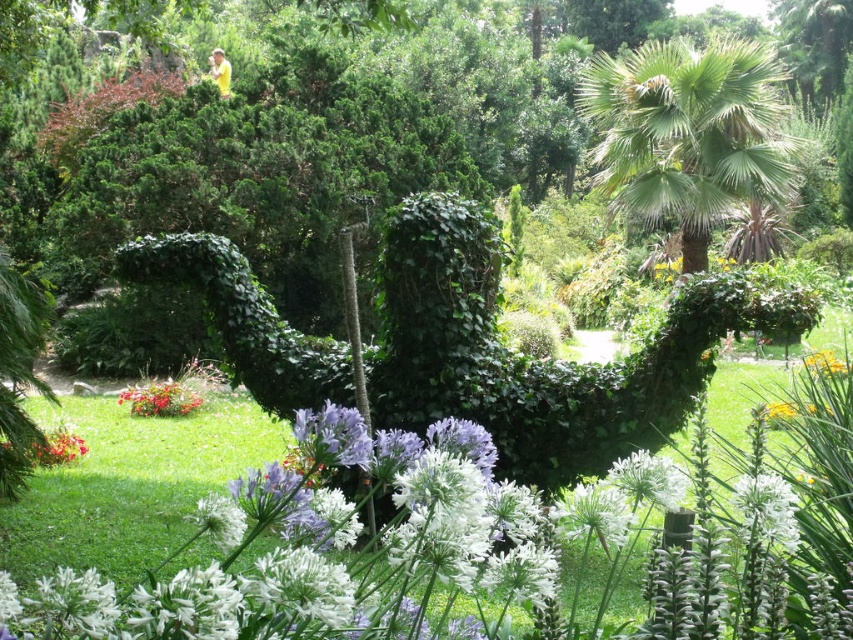
You are a gardener who wants to plant a new flower in the garden. You have two options from the image provided. Which of the two, the green leafy ivy at center or the bright red petals at lower left, would you choose if you want a plant that can cover a larger area?

The green leafy ivy at center has a larger size compared to the bright red petals at lower left, so it would be the better choice for covering a larger area.

Based on the photo, you are standing in the garden and want to place two markers at the coordinates point (425,316) and point (79,449). Which marker will be closer to you when placed?

Point (425,316) is closer to the viewer than point (79,449), so the marker at point (425,316) will be closer to you.

You are a gardener who wants to plant a new flower that needs partial shade. You notice the green leafy ivy at center and the bright red petals at lower left. Which area would provide more shade for the new flower?

The green leafy ivy at center is taller than the bright red petals at lower left, so it would provide more shade for the new flower.